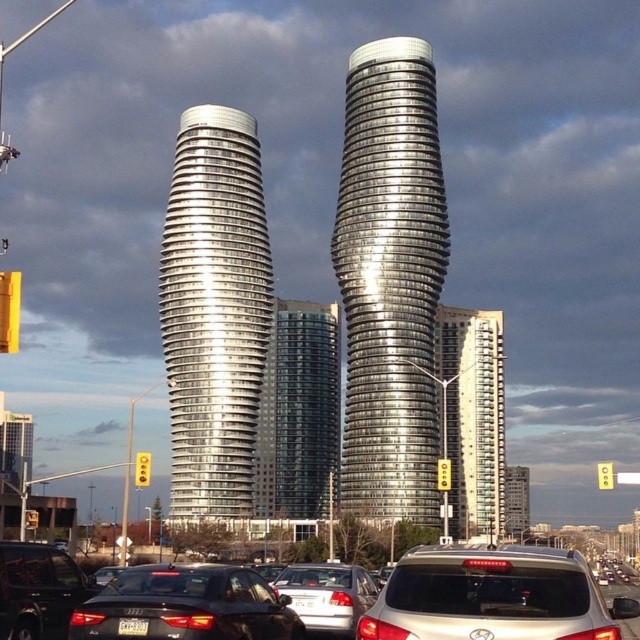
Is black glossy sedan at lower left closer to camera compared to satin silver sedan at center?

Yes, it is in front of satin silver sedan at center.

Based on the photo, who is more distant from viewer, [20,616] or [614,580]?

The point [614,580] is more distant.

The image size is (640, 640). What are the coordinates of `black glossy sedan at lower left` in the screenshot? It's located at (38, 589).

Is point (428, 225) behind point (205, 132)?

No, (428, 225) is closer to viewer.

Is metallic silver tower at center below polished silver skyscraper at center?

Actually, metallic silver tower at center is above polished silver skyscraper at center.

The height and width of the screenshot is (640, 640). Describe the element at coordinates (390, 280) in the screenshot. I see `metallic silver tower at center` at that location.

Find the location of a particular element. This screenshot has width=640, height=640. metallic silver tower at center is located at coordinates (390, 280).

Consider the image. Who is positioned more to the left, satin silver suv at center or black glossy sedan at lower center?

From the viewer's perspective, black glossy sedan at lower center appears more on the left side.

Is satin silver suv at center further to camera compared to black glossy sedan at lower center?

No, satin silver suv at center is in front of black glossy sedan at lower center.

Is point (577, 563) behind point (208, 577)?

No, it is not.

This screenshot has width=640, height=640. I want to click on satin silver suv at center, so click(492, 596).